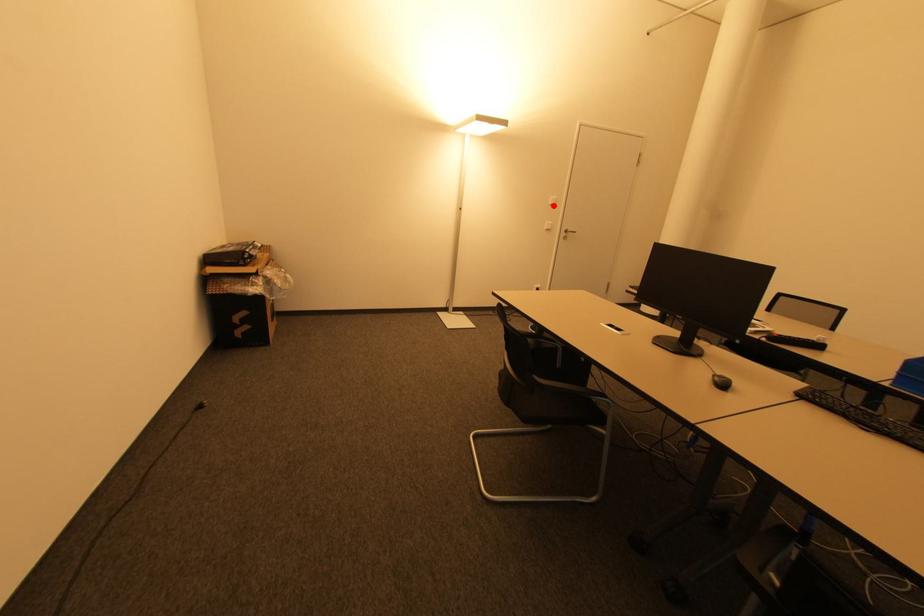
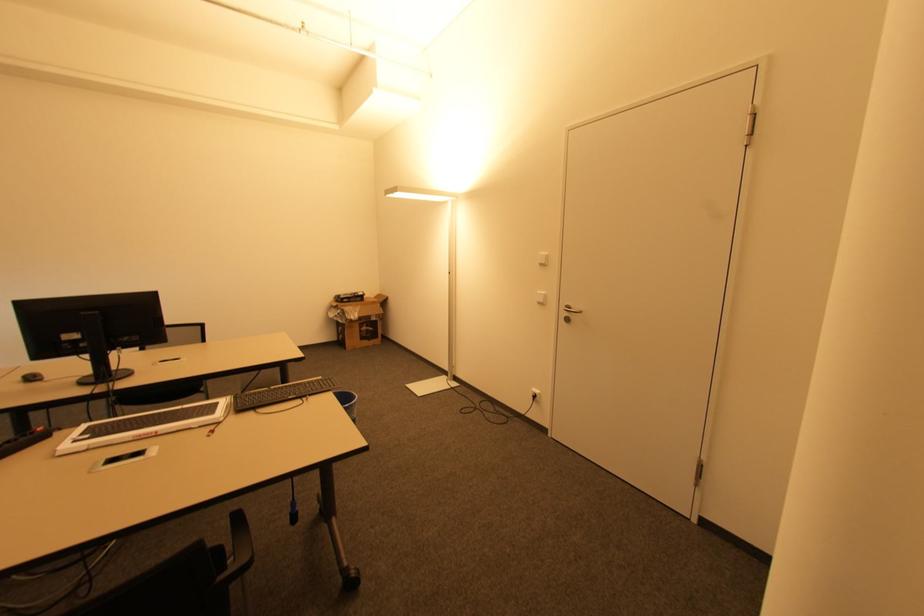
Question: I am providing you with two images of the same scene from different viewpoints. Image1 has a red point marked. In image2, the corresponding 3D location appears at what relative position? Reply with the corresponding letter.

Choices:
 (A) Closer
 (B) Farther

Answer: (B)